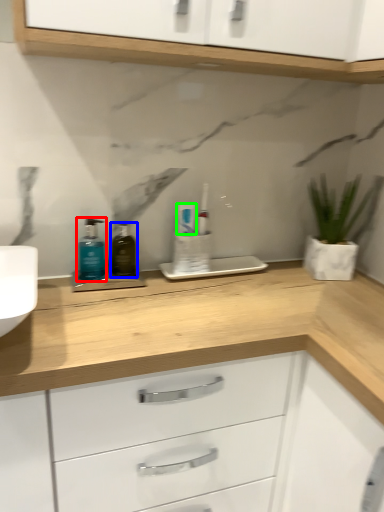
Question: Which is farther away from toiletry (highlighted by a red box)? mouthwash (highlighted by a blue box) or toothpaste (highlighted by a green box)?

Choices:
 (A) mouthwash
 (B) toothpaste

Answer: (B)